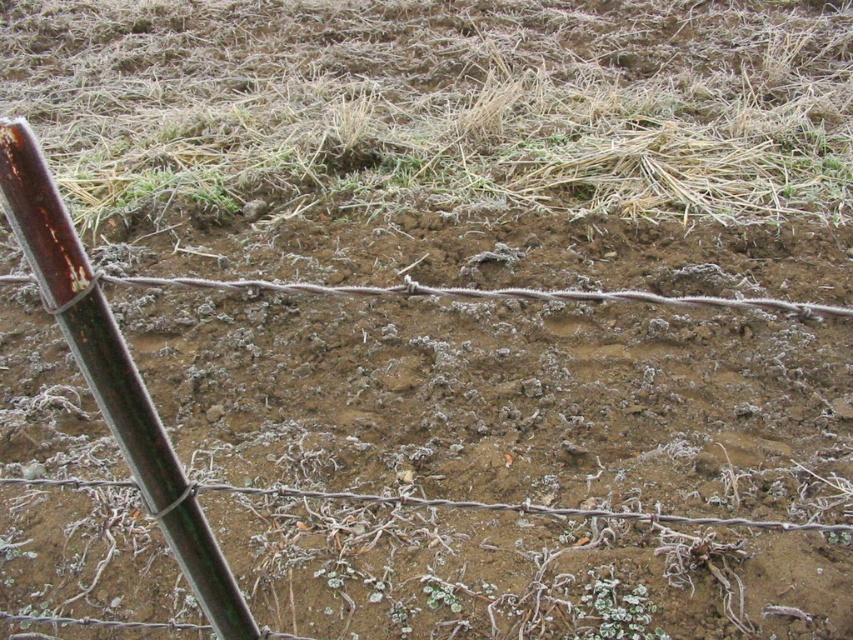
Is frosted dry grass at upper center in front of rusty metal pole at left?

That is False.

Is frosted dry grass at upper center smaller than rusty metal pole at left?

No.

Identify the location of frosted dry grass at upper center. The height and width of the screenshot is (640, 853). (436, 106).